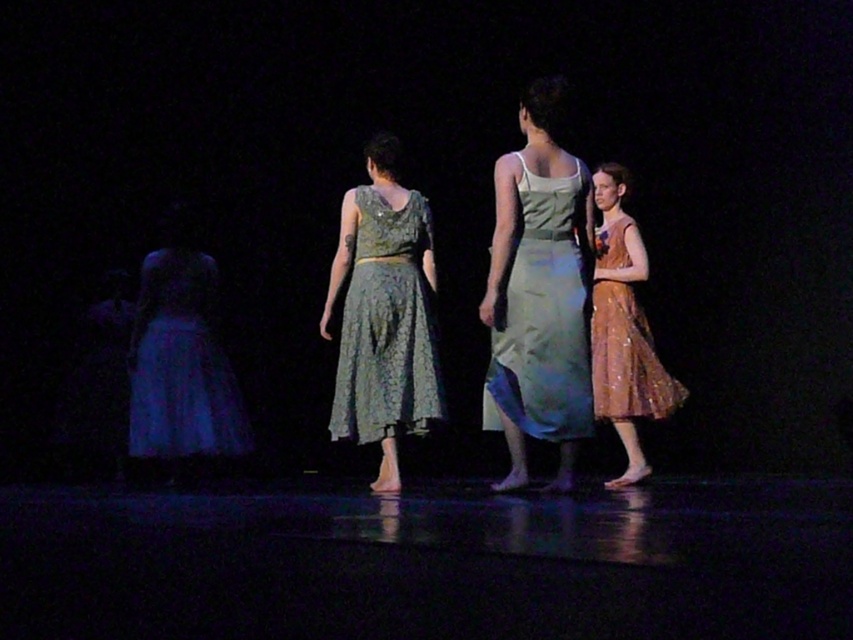
You are sitting in the front row of the audience watching the dance performance. You notice two points marked on the stage. The first point is at coordinates point (491, 346) and the second is at point (392, 412). Which point is closer to you?

Point (491, 346) is closer to the viewer than point (392, 412), so the first point is closer to you.

You are a stagehand preparing to adjust the lighting for a performance. You notice two dresses at center stage, the light green satin dress at center and the lace fabric dress at center. Which dress is covering part of the other?

The light green satin dress at center is positioned over the lace fabric dress at center, so it is covering part of the lace fabric dress at center.

You are a stagehand preparing to move a heavy prop from the left side of the stage to the right. You need to avoid stepping on any performers. Which performer should you go around, the light green satin dress at center or the matte blue dress at left?

You should go around the light green satin dress at center because it is in front of the matte blue dress at left, making it closer to your path.